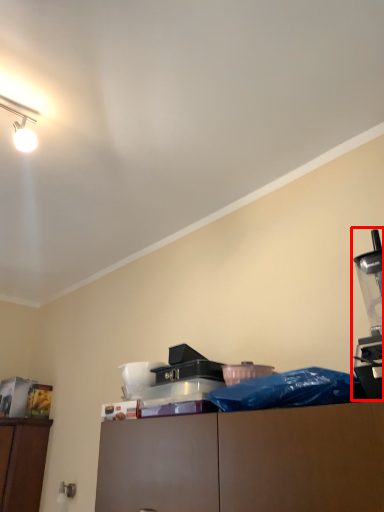
Question: From the image's perspective, considering the relative positions of coffee machine (annotated by the red box) and job in the image provided, where is coffee machine (annotated by the red box) located with respect to the staircase?

Choices:
 (A) above
 (B) below

Answer: (A)